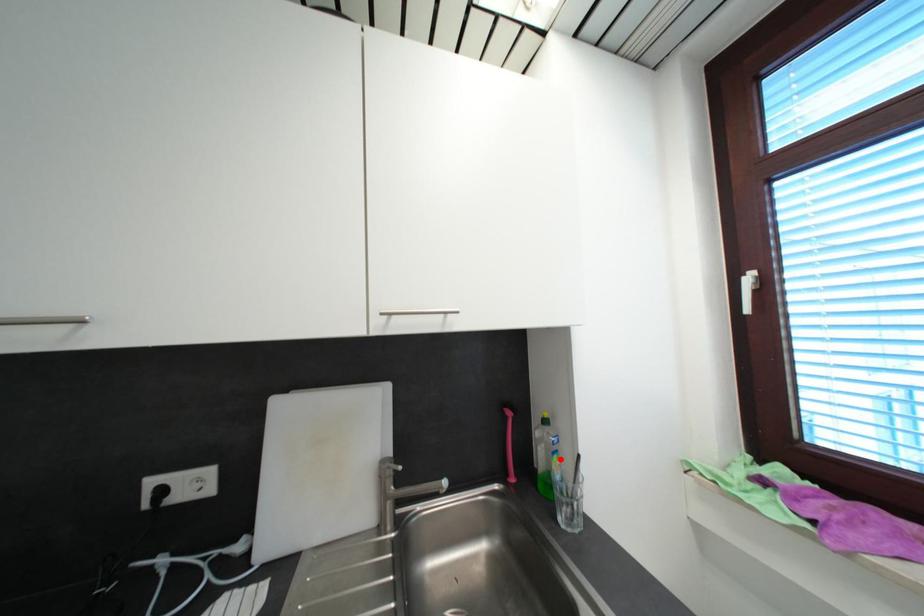
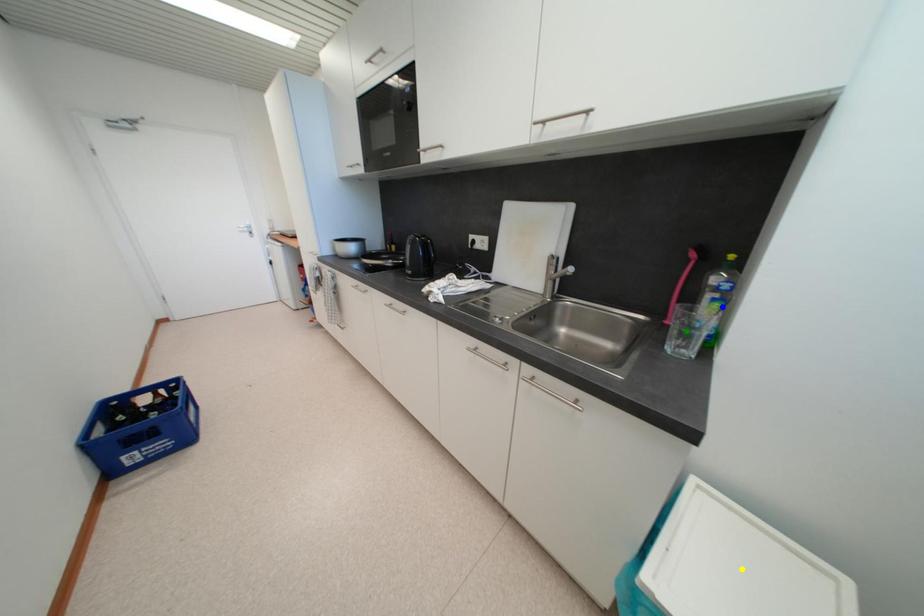
Question: I am providing you with two images of the same scene from different viewpoints. A red point is marked on the first image. You are given multiple points on the second image. Which spot in image 2 lines up with the point in image 1?

Choices:
 (A) blue point
 (B) yellow point
 (C) green point

Answer: (A)